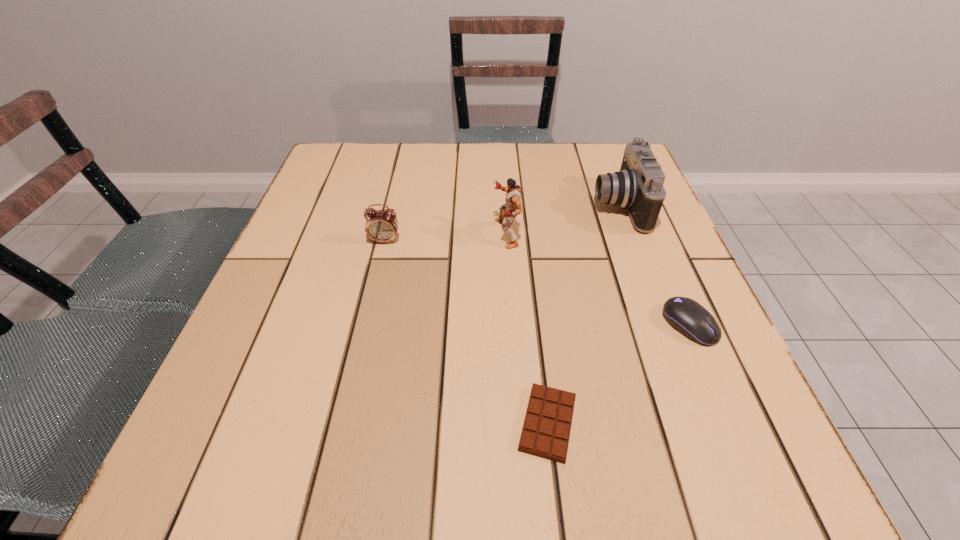
The image size is (960, 540). Identify the location of computer mouse positioned at the right edge. (688, 317).

Find the location of a particular element. The width and height of the screenshot is (960, 540). object that is at the far right corner is located at coordinates (638, 187).

The width and height of the screenshot is (960, 540). I want to click on free spot at the far edge of the desktop, so click(499, 179).

I want to click on free location at the left edge, so click(283, 280).

In the image, there is a desktop. Where is `vacant space at the right edge`? vacant space at the right edge is located at coordinates (637, 283).

In the image, there is a desktop. Identify the location of vacant space at the far left corner. This screenshot has width=960, height=540. (375, 151).

Locate an element on the screen. This screenshot has width=960, height=540. vacant region at the near left corner of the desktop is located at coordinates click(292, 441).

Locate an element on the screen. vacant area at the near right corner is located at coordinates (673, 478).

This screenshot has height=540, width=960. Identify the location of vacant space that is in between the leftmost object and the puncher. (445, 237).

The height and width of the screenshot is (540, 960). Identify the location of free space that is in between the camera and the computer mouse. (654, 265).